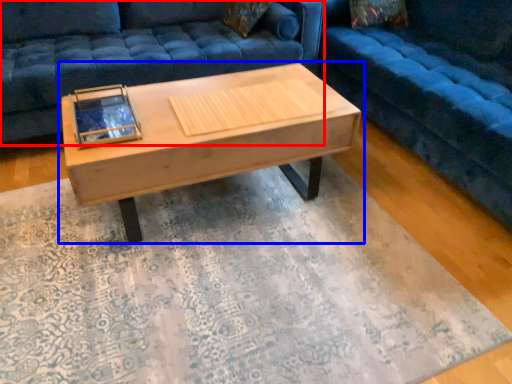
Question: Which of the following is the farthest to the observer, studio couch (highlighted by a red box) or coffee table (highlighted by a blue box)?

Choices:
 (A) studio couch
 (B) coffee table

Answer: (A)